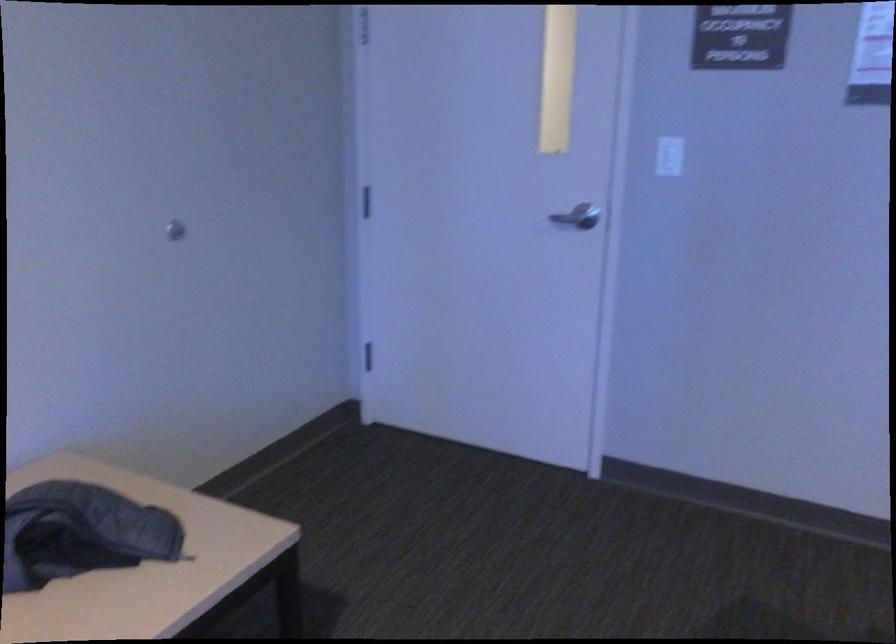
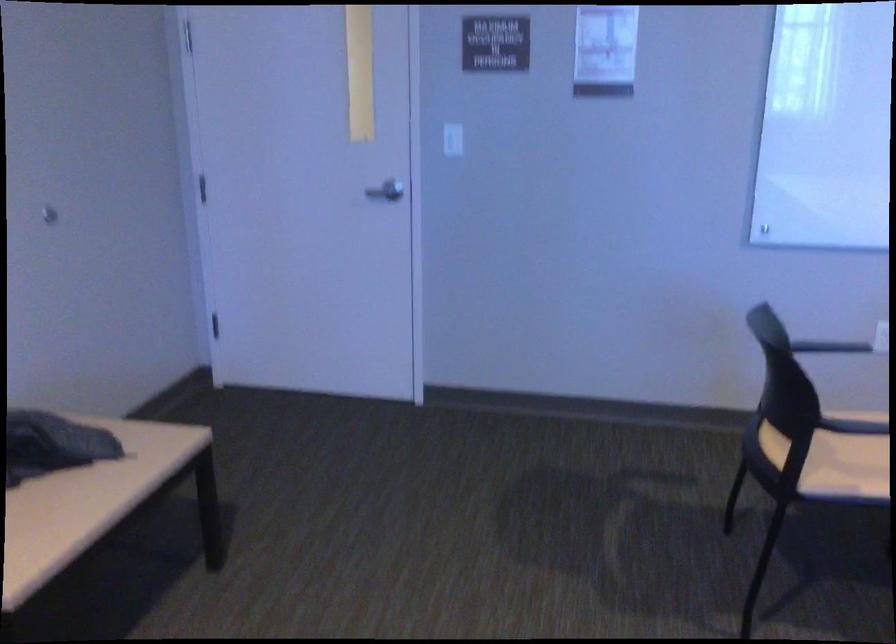
Question: In a continuous first-person perspective shot, in which direction is the camera moving?

Choices:
 (A) Left
 (B) Right
 (C) Forward
 (D) Backward

Answer: (D)